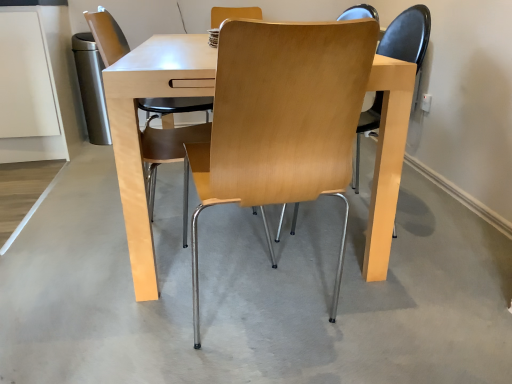
Describe the element at coordinates (168, 146) in the screenshot. I see `light wood/matte chair at center, the 2th chair viewed from the right` at that location.

Describe the element at coordinates (282, 121) in the screenshot. I see `light wood/chrome chair at center, the 1th chair when ordered from right to left` at that location.

The image size is (512, 384). What do you see at coordinates (253, 291) in the screenshot?
I see `light gray concrete at center` at bounding box center [253, 291].

Measure the distance between light gray concrete at center and camera.

light gray concrete at center and camera are 3.53 feet apart from each other.

Where is `light wood/matte chair at center, the 1th chair from the left`? Image resolution: width=512 pixels, height=384 pixels. light wood/matte chair at center, the 1th chair from the left is located at coordinates (168, 146).

Where is `chair below the light wood/matte chair at center, the 2th chair viewed from the right (from the image's perspective)`? The height and width of the screenshot is (384, 512). chair below the light wood/matte chair at center, the 2th chair viewed from the right (from the image's perspective) is located at coordinates (282, 121).

Between point (164, 154) and point (354, 63), which one is positioned in front?

Point (354, 63)

Which is correct: light wood/matte chair at center, the 2th chair viewed from the right, is inside light wood/chrome chair at center, the 1th chair when ordered from right to left, or outside of it?

light wood/matte chair at center, the 2th chair viewed from the right, is outside light wood/chrome chair at center, the 1th chair when ordered from right to left.

Consider the image. From the image's perspective, is light gray concrete at center located above or below light wood/chrome chair at center, the 1th chair when ordered from right to left?

Based on their image positions, light gray concrete at center is located beneath light wood/chrome chair at center, the 1th chair when ordered from right to left.

Considering the positions of objects light gray concrete at center and light wood/chrome chair at center, positioned as the 2th chair in left-to-right order, in the image provided, who is behind, light gray concrete at center or light wood/chrome chair at center, positioned as the 2th chair in left-to-right order,?

light gray concrete at center.

How far apart are light gray concrete at center and light wood/chrome chair at center, the 1th chair when ordered from right to left?

58.09 centimeters.

Can you tell me how much light gray concrete at center and light wood/chrome chair at center, the 1th chair when ordered from right to left, differ in facing direction?

light gray concrete at center and light wood/chrome chair at center, the 1th chair when ordered from right to left, are facing 180 degrees away from each other.

Is light wood/chrome chair at center, the 1th chair when ordered from right to left, looking in the opposite direction of light wood/matte chair at center, the 1th chair from the left?

No, light wood/chrome chair at center, the 1th chair when ordered from right to left, is not facing the opposite direction of light wood/matte chair at center, the 1th chair from the left.

From their relative heights in the image, would you say light wood/chrome chair at center, the 1th chair when ordered from right to left, is taller or shorter than light wood/matte chair at center, the 2th chair viewed from the right?

In the image, light wood/chrome chair at center, the 1th chair when ordered from right to left, appears to be shorter than light wood/matte chair at center, the 2th chair viewed from the right.

Is light wood/chrome chair at center, the 1th chair when ordered from right to left, not near light wood/matte chair at center, the 1th chair from the left?

light wood/chrome chair at center, the 1th chair when ordered from right to left, is far away from light wood/matte chair at center, the 1th chair from the left.

From a real-world perspective, is light wood/chrome chair at center, positioned as the 2th chair in left-to-right order, over light wood/matte chair at center, the 2th chair viewed from the right?

Actually, light wood/chrome chair at center, positioned as the 2th chair in left-to-right order, is physically below light wood/matte chair at center, the 2th chair viewed from the right, in the real world.

Locate an element on the screen. The image size is (512, 384). concrete on the left of the light wood/chrome chair at center, positioned as the 2th chair in left-to-right order is located at coordinates (253, 291).

Is the depth of light wood/chrome chair at center, positioned as the 2th chair in left-to-right order, greater than that of light gray concrete at center?

No, it is not.

Is light wood/chrome chair at center, the 1th chair when ordered from right to left, taller or shorter than light gray concrete at center?

In the image, light wood/chrome chair at center, the 1th chair when ordered from right to left, appears to be taller than light gray concrete at center.

Between light wood/chrome chair at center, positioned as the 2th chair in left-to-right order, and light gray concrete at center, which one has smaller size?

light wood/chrome chair at center, positioned as the 2th chair in left-to-right order.

Is light wood/matte chair at center, the 1th chair from the left, far from light gray concrete at center?

Yes.

Does point (179, 141) lie behind point (0, 380)?

Yes, point (179, 141) is farther from viewer.

From a real-world perspective, is light wood/matte chair at center, the 1th chair from the left, below light gray concrete at center?

No, from a real-world perspective, light wood/matte chair at center, the 1th chair from the left, is not below light gray concrete at center.

Where is `the 1st chair counting from the right of the light gray concrete at center`? the 1st chair counting from the right of the light gray concrete at center is located at coordinates (168, 146).

From a real-world perspective, relative to light wood/matte chair at center, the 1th chair from the left, is light gray concrete at center vertically above or below?

Clearly, from a real-world perspective, light gray concrete at center is below light wood/matte chair at center, the 1th chair from the left.

From the image's perspective, starting from the light gray concrete at center, which chair is the 2nd one above? Please provide its 2D coordinates.

[(168, 146)]

Can you confirm if light gray concrete at center is thinner than light wood/matte chair at center, the 1th chair from the left?

Incorrect, the width of light gray concrete at center is not less than that of light wood/matte chair at center, the 1th chair from the left.

Consider the image. Considering the relative positions of light gray concrete at center and light wood/matte chair at center, the 2th chair viewed from the right, in the image provided, is light gray concrete at center to the right of light wood/matte chair at center, the 2th chair viewed from the right, from the viewer's perspective?

No, light gray concrete at center is not to the right of light wood/matte chair at center, the 2th chair viewed from the right.

I want to click on chair that appears on the right of light wood/matte chair at center, the 2th chair viewed from the right, so click(282, 121).

Locate an element on the screen. The image size is (512, 384). the 1st chair positioned above the light gray concrete at center (from the image's perspective) is located at coordinates (282, 121).

Considering their positions, is light wood/matte chair at center, the 2th chair viewed from the right, positioned further to light gray concrete at center than light wood/chrome chair at center, the 1th chair when ordered from right to left?

Among the two, light wood/matte chair at center, the 2th chair viewed from the right, is located further to light gray concrete at center.

When comparing their distances from light wood/matte chair at center, the 1th chair from the left, does light gray concrete at center or light wood/chrome chair at center, positioned as the 2th chair in left-to-right order, seem further?

light wood/chrome chair at center, positioned as the 2th chair in left-to-right order.

Estimate the real-world distances between objects in this image. Which object is further from light wood/matte chair at center, the 2th chair viewed from the right, light wood/chrome chair at center, positioned as the 2th chair in left-to-right order, or light gray concrete at center?

light wood/chrome chair at center, positioned as the 2th chair in left-to-right order, lies further to light wood/matte chair at center, the 2th chair viewed from the right, than the other object.

Considering their positions, is light gray concrete at center positioned closer to light wood/chrome chair at center, the 1th chair when ordered from right to left, than light wood/matte chair at center, the 2th chair viewed from the right?

light gray concrete at center is closer to light wood/chrome chair at center, the 1th chair when ordered from right to left.

Looking at the image, which one is located closer to light wood/chrome chair at center, positioned as the 2th chair in left-to-right order, light wood/matte chair at center, the 2th chair viewed from the right, or light gray concrete at center?

light gray concrete at center is closer to light wood/chrome chair at center, positioned as the 2th chair in left-to-right order.

Looking at the image, which one is located closer to light gray concrete at center, light wood/chrome chair at center, positioned as the 2th chair in left-to-right order, or light wood/matte chair at center, the 1th chair from the left?

light wood/chrome chair at center, positioned as the 2th chair in left-to-right order, lies closer to light gray concrete at center than the other object.

Identify the location of concrete between light wood/chrome chair at center, positioned as the 2th chair in left-to-right order, and light wood/matte chair at center, the 2th chair viewed from the right, in the front-back direction. (253, 291).